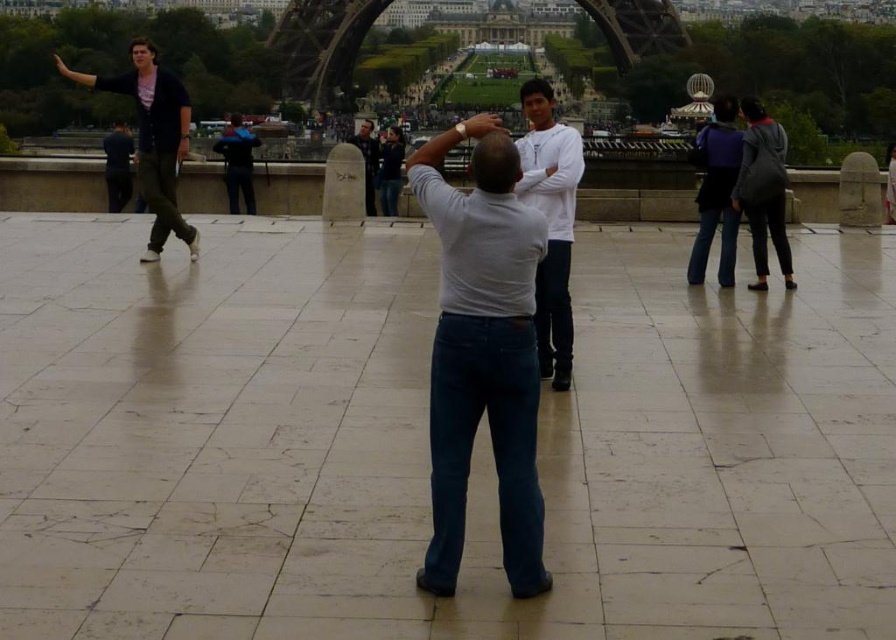
You are a photographer standing in the plaza and see the metallic structure at center and the dark blue jeans at right. Which object is closer to you?

The metallic structure at center is closer to you because it is positioned over the dark blue jeans at right, indicating it is in a more forward spatial plane.

You are standing at point (x=388, y=161) and want to take a photo of the Eiffel Tower. There is a person at point (x=762, y=166) blocking your view. Can you move to the left or right to avoid them?

Point (x=762, y=166) is in front of point (x=388, y=161), so moving to the left or right may not help since the person is directly in front of you. You might need to move backward or forward instead.